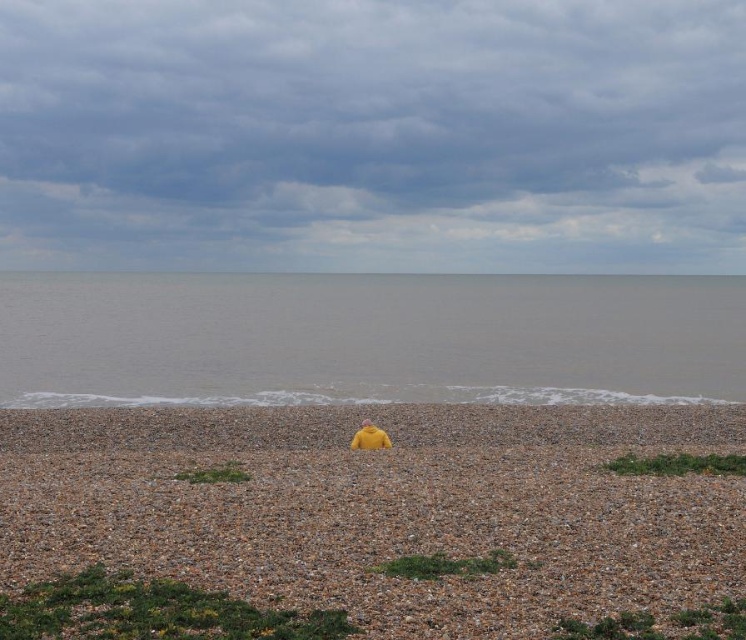
Question: Is yellow fabric at center in front of gray matte water at center?

Choices:
 (A) yes
 (B) no

Answer: (A)

Question: Which point is closer to the camera?

Choices:
 (A) (568, 364)
 (B) (711, 496)

Answer: (B)

Question: Which of the following is the closest to the observer?

Choices:
 (A) (724, 544)
 (B) (351, 300)

Answer: (A)

Question: Can you confirm if yellow fabric at center is positioned to the right of gray matte water at center?

Choices:
 (A) no
 (B) yes

Answer: (A)

Question: Is yellow fabric at center wider than gray matte water at center?

Choices:
 (A) yes
 (B) no

Answer: (B)